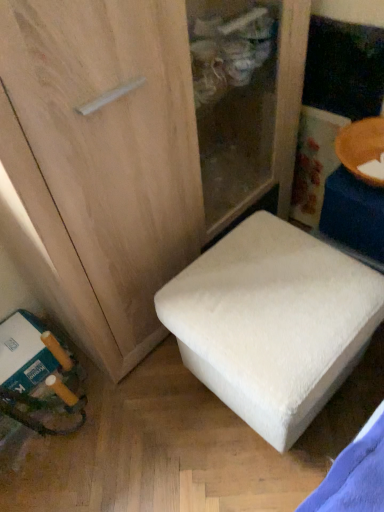
Find the location of a particular element. vacant space to the left of white fluffy ottoman at center is located at coordinates (152, 426).